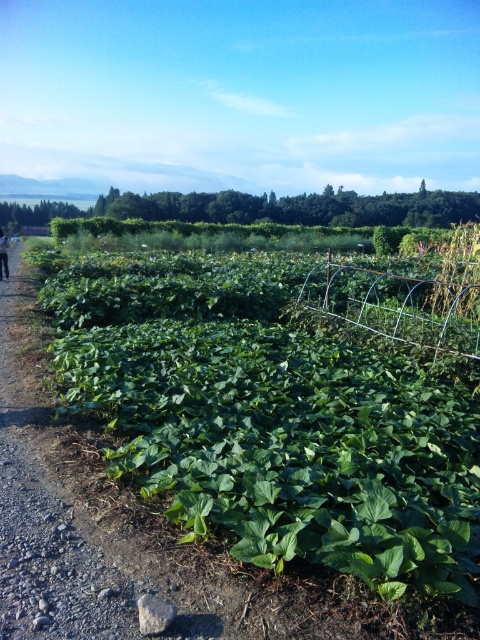
You are a farmer checking the crops in the field. You notice the green leafy plant at center and the black fabric at left. Which object is positioned lower in the scene?

The green leafy plant at center is positioned lower than the black fabric at left.

Looking at this image, you are a farmer looking at your field. You notice the green leafy plant at center and the black fabric at left. Which object is positioned more to the east side of the field?

The black fabric at left is positioned more to the east side of the field because the green leafy plant at center is to its right, implying the black fabric is on the left side facing east.